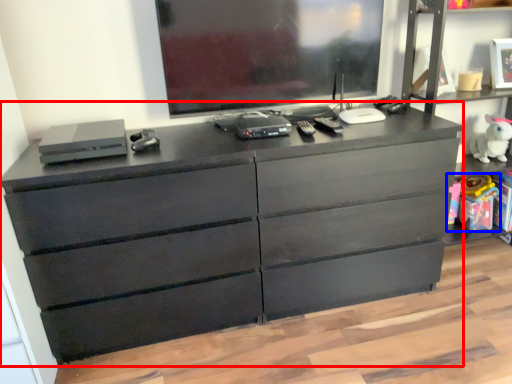
Question: Which of the following is the farthest to the observer, chest of drawers (highlighted by a red box) or toy (highlighted by a blue box)?

Choices:
 (A) chest of drawers
 (B) toy

Answer: (B)